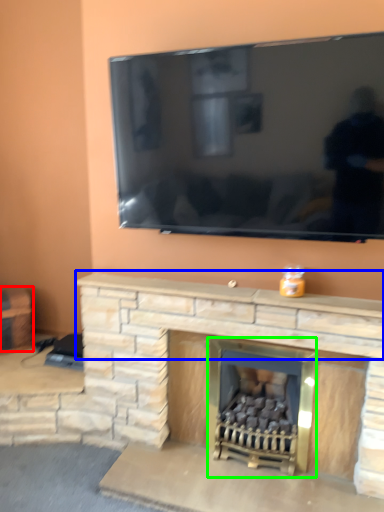
Question: Considering the real-world distances, which object is closest to furniture (highlighted by a red box)? mantle (highlighted by a blue box) or fireplace (highlighted by a green box).

Choices:
 (A) mantle
 (B) fireplace

Answer: (A)